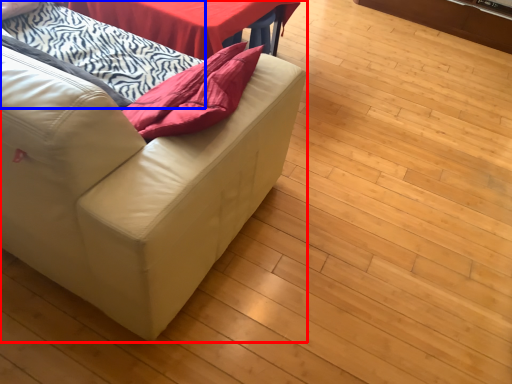
Question: Which object appears farthest to the camera in this image, studio couch (highlighted by a red box) or blanket (highlighted by a blue box)?

Choices:
 (A) studio couch
 (B) blanket

Answer: (B)